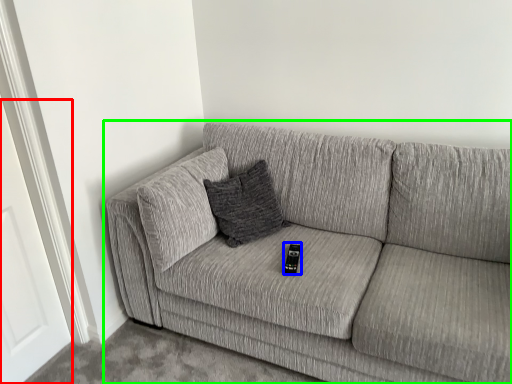
Question: Estimate the real-world distances between objects in this image. Which object is closer to door (highlighted by a red box), remote (highlighted by a blue box) or studio couch (highlighted by a green box)?

Choices:
 (A) remote
 (B) studio couch

Answer: (B)